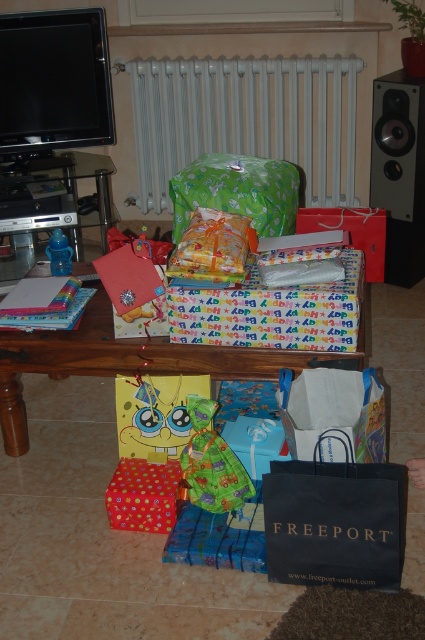
You are a guest at a birthday party and want to grab a gift from the scene. You see the wooden table at center and the colorful paper wrapped gift at center. Which gift is closer to you?

The wooden table at center is closer to you because the colorful paper wrapped gift at center is behind it.

You are standing in the living room and notice the white metallic radiator at upper center and the polka dot paper gift at center. Which object is positioned higher in the scene?

The white metallic radiator at upper center is located above the polka dot paper gift at center, so it is positioned higher in the scene.